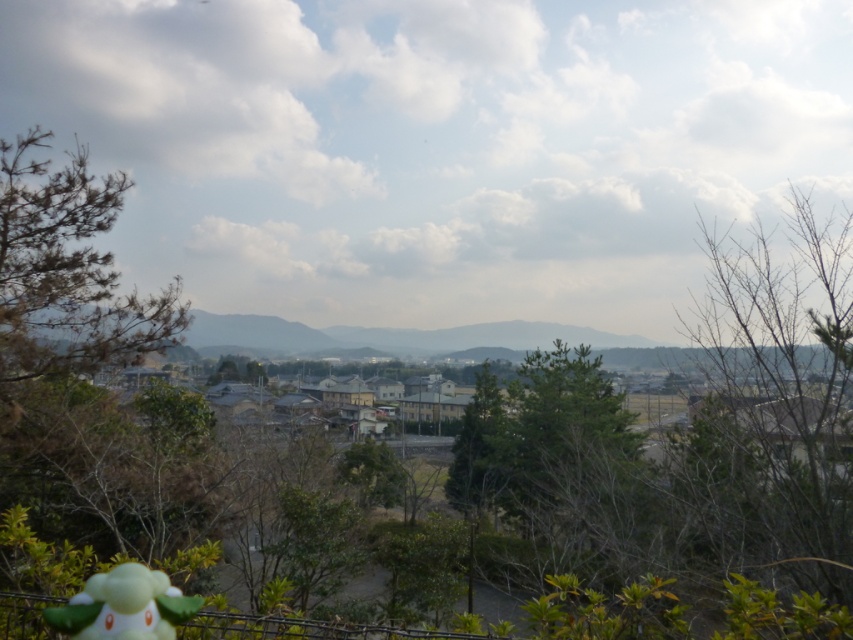
Question: Can you confirm if green leafy tree at left is thinner than white matte plush at lower left?

Choices:
 (A) yes
 (B) no

Answer: (B)

Question: Among these objects, which one is nearest to the camera?

Choices:
 (A) bare branches at upper right
 (B) green leafy tree at center
 (C) green leafy tree at left

Answer: (A)

Question: Among these objects, which one is farthest from the camera?

Choices:
 (A) bare branches at upper right
 (B) white matte plush at lower left
 (C) green leafy tree at left
 (D) green leafy tree at center

Answer: (D)

Question: Is green leafy tree at left behind green leafy tree at center?

Choices:
 (A) no
 (B) yes

Answer: (A)

Question: Can you confirm if green leafy tree at left is smaller than white matte plush at lower left?

Choices:
 (A) yes
 (B) no

Answer: (B)

Question: Among these points, which one is nearest to the camera?

Choices:
 (A) (138, 339)
 (B) (624, 396)
 (C) (99, 621)
 (D) (718, 355)

Answer: (C)